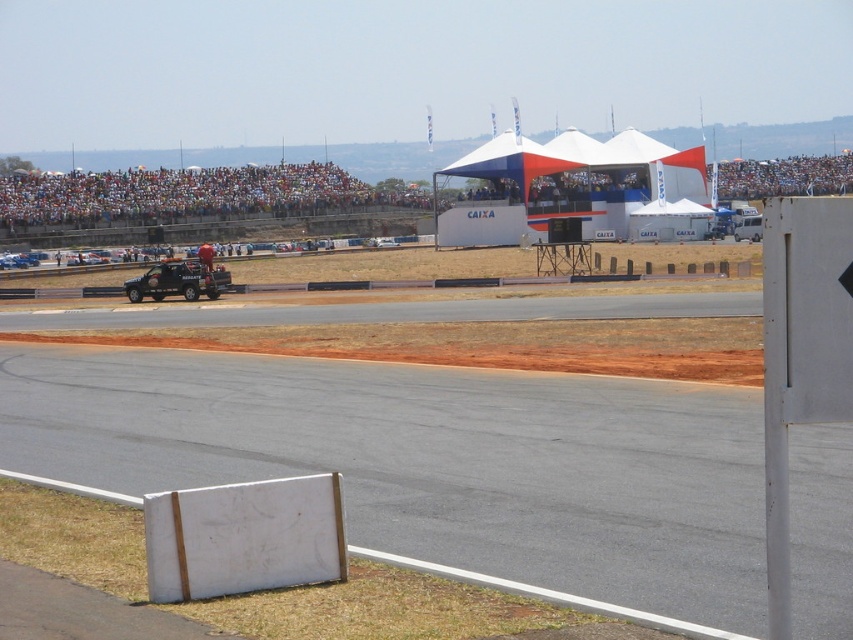
Who is more forward, (813,173) or (187,296)?

Point (187,296) is in front.

Where is `multicolored fabric crowd at upper center`? multicolored fabric crowd at upper center is located at coordinates (190, 196).

Where is `multicolored fabric crowd at upper center`? multicolored fabric crowd at upper center is located at coordinates (190, 196).

Can you confirm if white smooth board at center is positioned to the left of multicolored fabric crowd at upper center?

Yes, white smooth board at center is to the left of multicolored fabric crowd at upper center.

Between white smooth board at center and multicolored fabric crowd at upper center, which one appears on the right side from the viewer's perspective?

From the viewer's perspective, multicolored fabric crowd at upper center appears more on the right side.

Between point (469, 408) and point (28, 204), which one is positioned in front?

Point (469, 408)

Identify the location of white smooth board at center. The height and width of the screenshot is (640, 853). (433, 460).

Does white smooth board at center have a greater width compared to matte black suv at center?

Yes.

Does point (196, 371) come farther from viewer compared to point (129, 282)?

No, it is not.

Between point (703, 460) and point (177, 289), which one is positioned in front?

Point (703, 460) is more forward.

At what (x,y) coordinates should I click in order to perform the action: click on white smooth board at center. Please return your answer as a coordinate pair (x, y). Looking at the image, I should click on (433, 460).